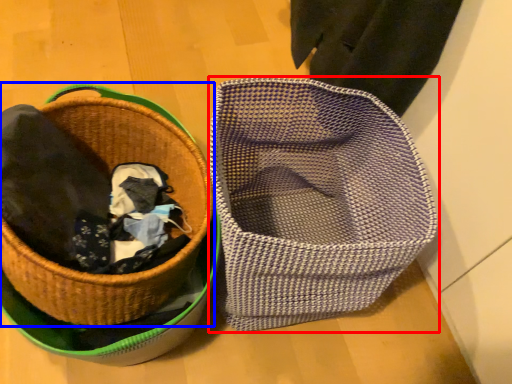
Question: Which object is further to the camera taking this photo, basket (highlighted by a red box) or picnic basket (highlighted by a blue box)?

Choices:
 (A) basket
 (B) picnic basket

Answer: (A)